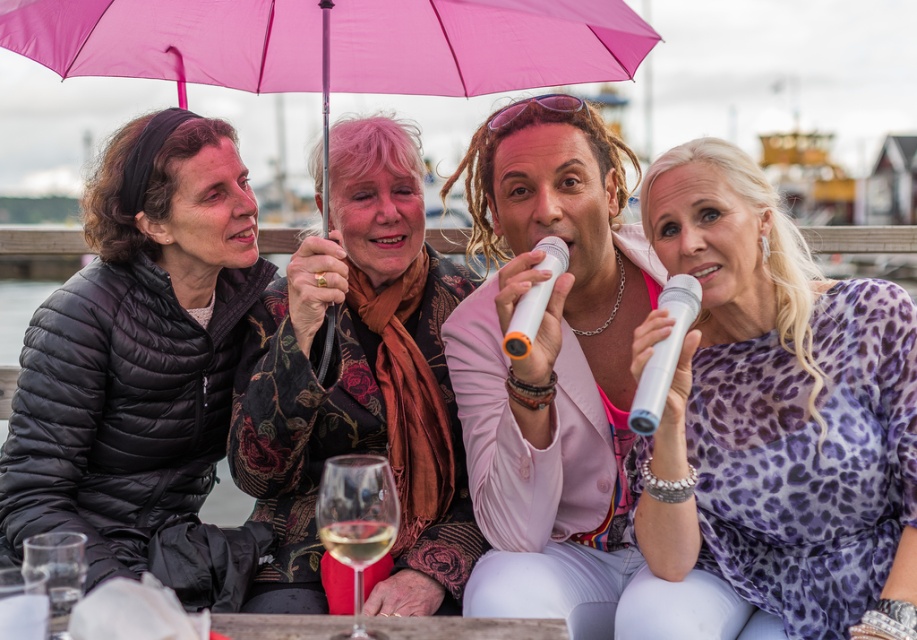
In the scene described, there are a purple leopard print dress at center and a translucent glass at lower center. From the perspective of someone facing the group, which object is positioned to the right of the other?

The purple leopard print dress at center is to the right of the translucent glass at lower center.

You are a photographer positioned behind the group and want to capture a clear shot of the translucent glass at lower center. However, the purple leopard print dress at center is blocking your view. Can you adjust your position to avoid the dress and still see the glass?

The purple leopard print dress at center is further to the viewer than the translucent glass at lower center, so moving slightly to the side or adjusting your angle might allow you to see around the dress and still capture the translucent glass at lower center.

You are a photographer taking a picture of the purple leopard print dress at center and the translucent glass at lower center. Which object should you focus on first if you want to capture both in the same frame without moving the camera?

The purple leopard print dress at center is taller than the translucent glass at lower center, so you should focus on the purple leopard print dress at center first to ensure it is in clear view before adjusting for the other object.